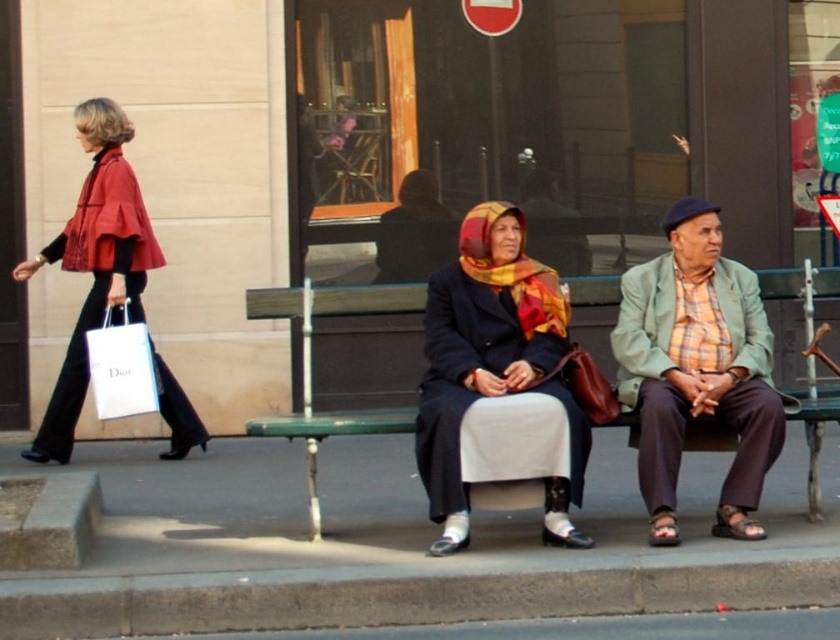
You are a delivery person trying to navigate the sidewalk in the image. The concrete pavement at lower center and the gray concrete curb at lower left are both in your path. Which one is positioned to the left side of the other?

The concrete pavement at lower center is to the left of the gray concrete curb at lower left.

You are a tailor who needs to determine which of the two garments, the matte black coat at center or the matte red cape at left, requires more fabric for a custom order. Based on their visible sizes in the image, which one would need more fabric?

The matte red cape at left requires more fabric because it is wider than the matte black coat at center.